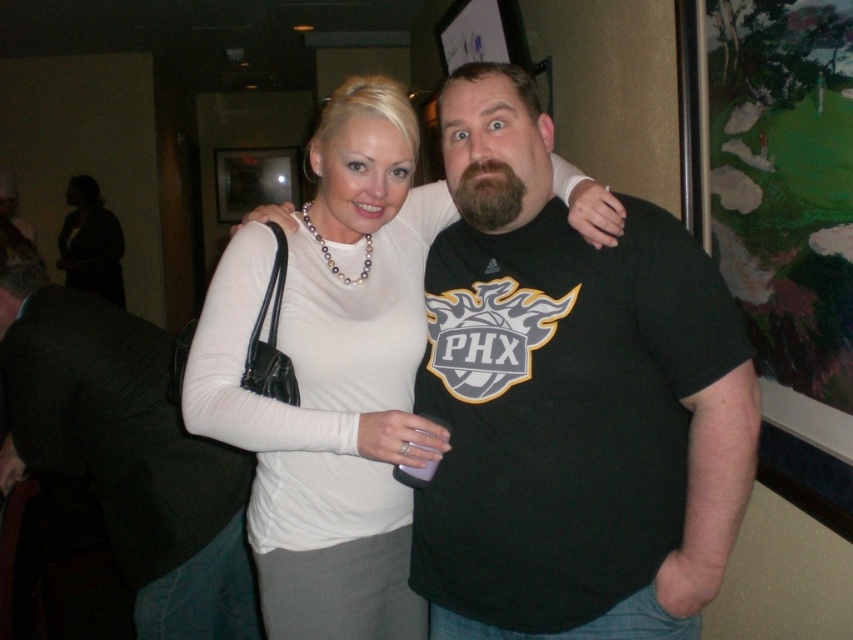
Is black matte jacket at center closer to the viewer compared to matte white blouse at upper center?

Yes.

Does black matte jacket at center have a larger size compared to matte white blouse at upper center?

No.

Who is more distant from viewer, (x=51, y=314) or (x=79, y=212)?

Point (x=79, y=212)

Locate an element on the screen. The image size is (853, 640). black matte jacket at center is located at coordinates (125, 449).

Does white pearl necklace at upper center lie in front of black matte jacket at center?

That is True.

The image size is (853, 640). What are the coordinates of `white pearl necklace at upper center` in the screenshot? It's located at (332, 378).

Locate an element on the screen. white pearl necklace at upper center is located at coordinates (332, 378).

The image size is (853, 640). In order to click on white pearl necklace at upper center in this screenshot , I will do `click(332, 378)`.

Which is above, white pearl necklace at upper center or matte white blouse at upper center?

Positioned higher is matte white blouse at upper center.

Between point (305, 481) and point (109, 250), which one is positioned behind?

The point (109, 250) is behind.

Locate an element on the screen. The height and width of the screenshot is (640, 853). white pearl necklace at upper center is located at coordinates (332, 378).